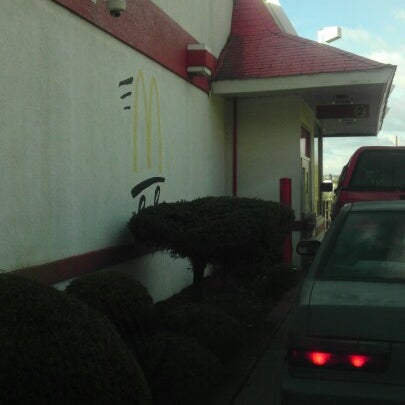
Where is `back window`? back window is located at coordinates (375, 241).